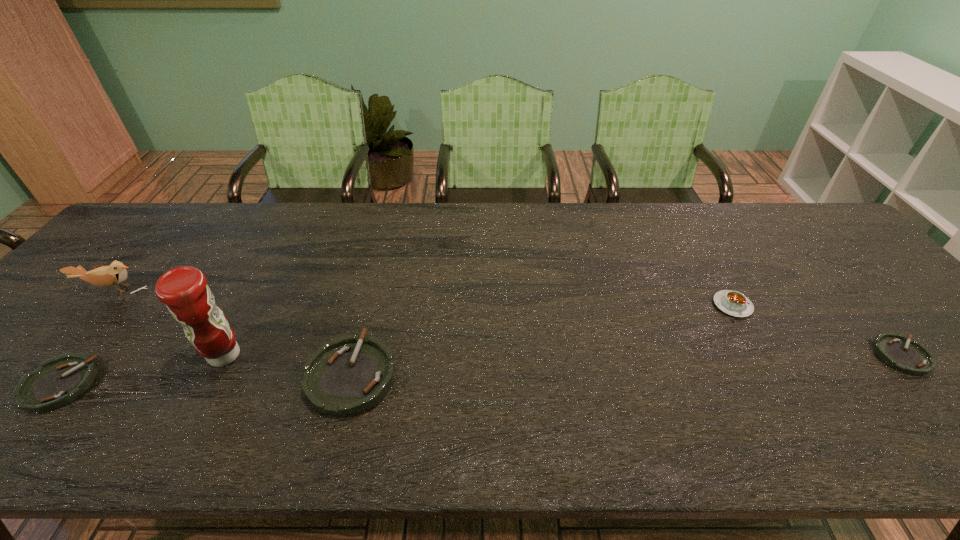
Find the location of a particular element. The height and width of the screenshot is (540, 960). object that is at the near left corner is located at coordinates (58, 381).

Locate an element on the screen. The height and width of the screenshot is (540, 960). object located in the near right corner section of the desktop is located at coordinates (910, 357).

Find the location of a particular element. free space at the far edge of the desktop is located at coordinates click(501, 241).

Where is `free location at the right edge of the desktop`? The image size is (960, 540). free location at the right edge of the desktop is located at coordinates (829, 250).

The image size is (960, 540). Find the location of `free space at the far right corner of the desktop`. free space at the far right corner of the desktop is located at coordinates (797, 226).

In the image, there is a desktop. Where is `vacant space at the near right corner`? vacant space at the near right corner is located at coordinates (928, 393).

The height and width of the screenshot is (540, 960). In order to click on vacant point located between the third object from right to left and the tallest object in this screenshot , I will do `click(288, 365)`.

You are a GUI agent. You are given a task and a screenshot of the screen. Output one action in this format:
    pyautogui.click(x=<x>, y=<y>)
    Task: Click on the vacant space in between the rightmost object and the second object from right to left
    This screenshot has height=540, width=960.
    Given the screenshot: What is the action you would take?
    pyautogui.click(x=817, y=330)

Where is `vacant space in between the third object from right to left and the fourth object from right to left`? The height and width of the screenshot is (540, 960). vacant space in between the third object from right to left and the fourth object from right to left is located at coordinates (288, 365).

This screenshot has height=540, width=960. Find the location of `free point between the tallest object and the leftmost ashtray`. free point between the tallest object and the leftmost ashtray is located at coordinates (142, 370).